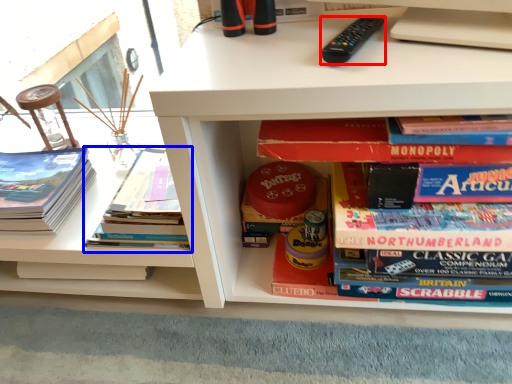
Question: Which point is closer to the camera, remote control (highlighted by a red box) or book (highlighted by a blue box)?

Choices:
 (A) remote control
 (B) book

Answer: (A)